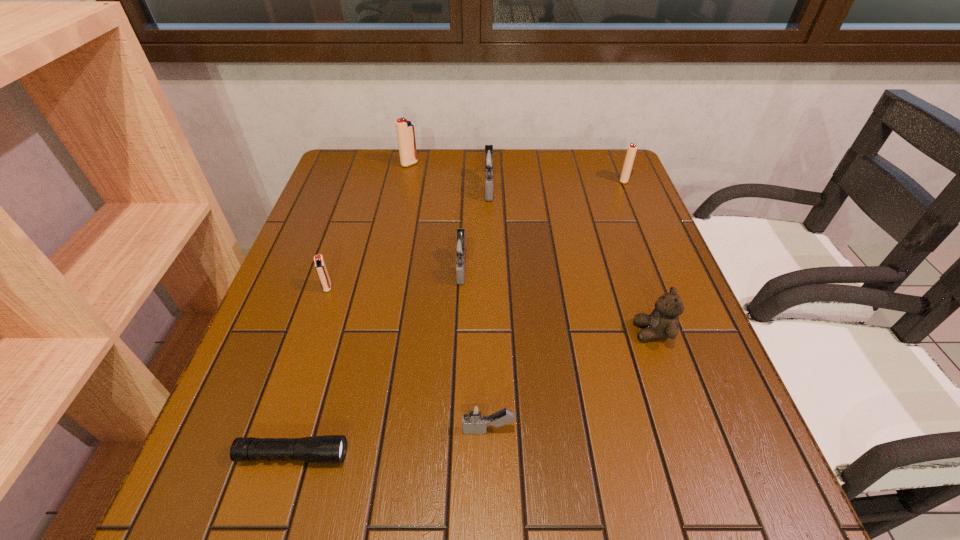
At what (x,y) coordinates should I click in order to perform the action: click on the farthest igniter. Please return your answer as a coordinate pair (x, y). The image size is (960, 540). Looking at the image, I should click on (405, 131).

Identify the location of the second red igniter from left to right. This screenshot has height=540, width=960. (405, 131).

At what (x,y) coordinates should I click in order to perform the action: click on the biggest gray igniter. Please return your answer as a coordinate pair (x, y). Image resolution: width=960 pixels, height=540 pixels. Looking at the image, I should click on (488, 159).

Locate an element on the screen. the second nearest gray igniter is located at coordinates (460, 247).

Where is `the rightmost object`? the rightmost object is located at coordinates 631,151.

The image size is (960, 540). I want to click on the second nearest red igniter, so click(631, 151).

Image resolution: width=960 pixels, height=540 pixels. In order to click on teddy bear in this screenshot , I will do `click(663, 322)`.

The image size is (960, 540). I want to click on the sixth farthest object, so click(663, 322).

Identify the location of the smallest red igniter. Image resolution: width=960 pixels, height=540 pixels. (x=320, y=266).

The image size is (960, 540). Find the location of `the leftmost red igniter`. the leftmost red igniter is located at coordinates (320, 266).